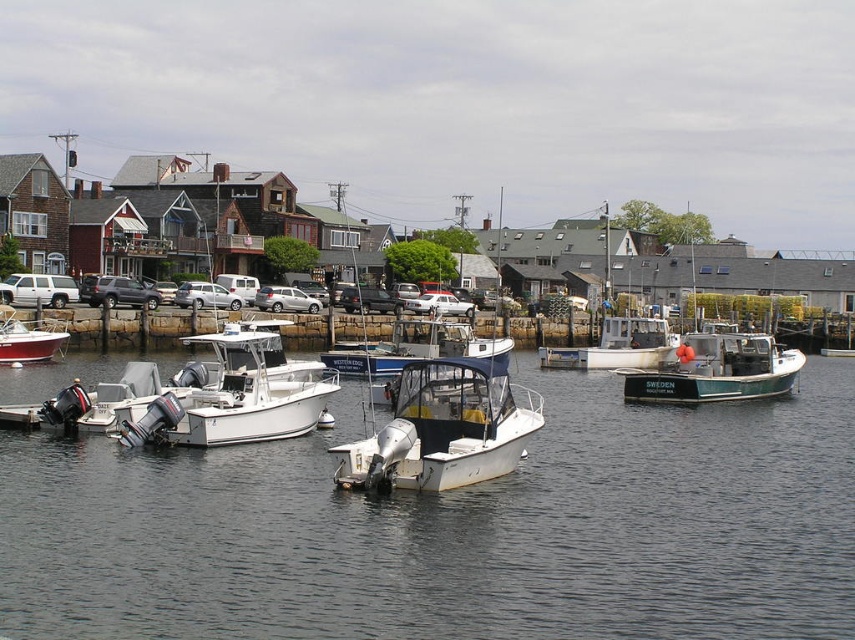
Question: Which point is closer to the camera taking this photo?

Choices:
 (A) (3, 337)
 (B) (140, 419)

Answer: (B)

Question: Which point is farther to the camera?

Choices:
 (A) green painted wooden fishing boat at center
 (B) white matte motorboat at left
 (C) white plastic boat at center
 (D) white matte boat at center

Answer: (C)

Question: Is white matte boat at center in front of green painted wooden fishing boat at center?

Choices:
 (A) yes
 (B) no

Answer: (A)

Question: Can you confirm if white matte water at center is positioned above white matte motorboat at left?

Choices:
 (A) yes
 (B) no

Answer: (B)

Question: Which is farther from the white matte boat at center?

Choices:
 (A) white matte motorboat at left
 (B) green painted wooden fishing boat at center
 (C) white plastic boat at center
 (D) matte white boat at left

Answer: (B)

Question: Observing the image, what is the correct spatial positioning of white matte water at center in reference to white matte motorboat at left?

Choices:
 (A) above
 (B) below

Answer: (B)